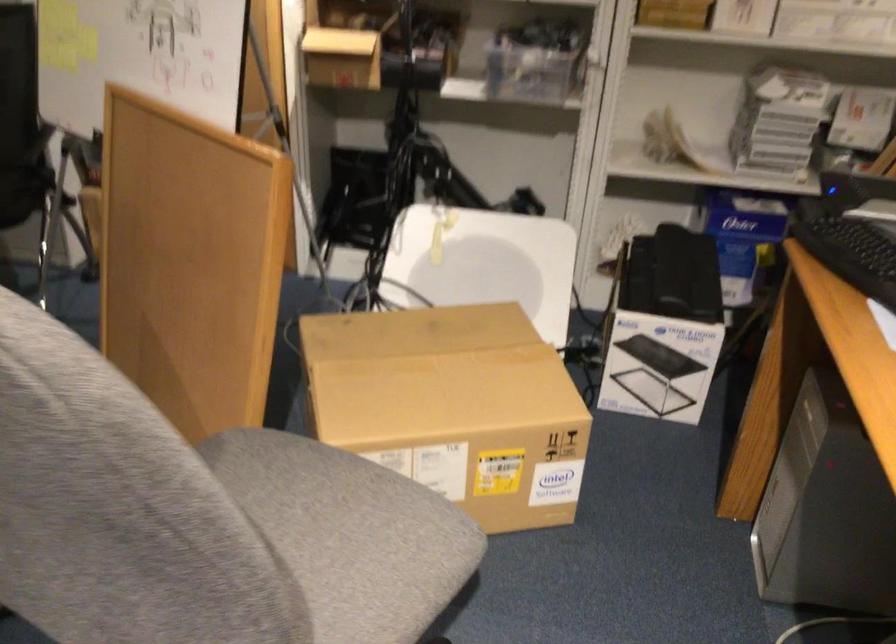
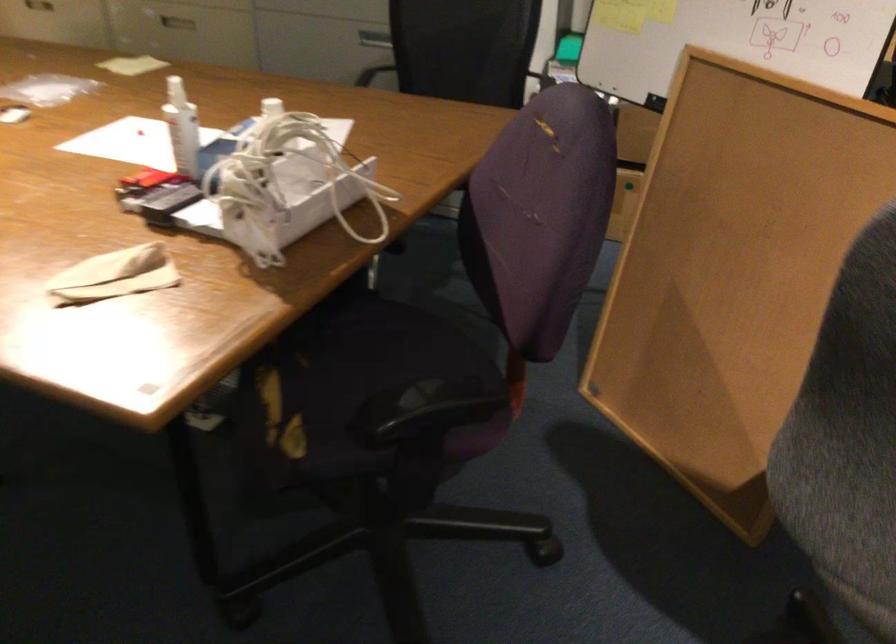
Question: What movement of the cameraman would produce the second image?

Choices:
 (A) Left
 (B) Right
 (C) Forward
 (D) Backward

Answer: (A)